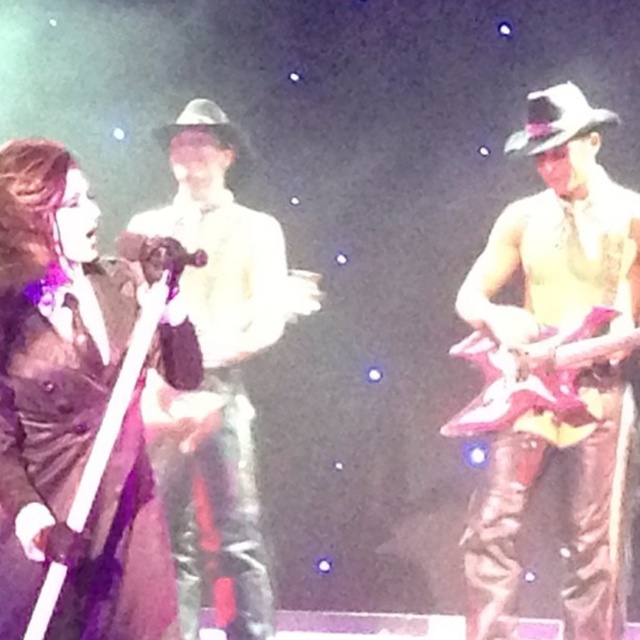
You are a photographer at the back of the stage. You want to take a photo of the matte black hat at center and the metallic pink guitar at right. Based on their positions, which object is closer to the left edge of your camera frame?

The matte black hat at center is positioned on the left side of the metallic pink guitar at right, so the matte black hat at center is closer to the left edge of the camera frame.

You are a stagehand who needs to place a new spotlight on the stage. The spotlight can only illuminate objects that are larger than 1 meter in size. Based on the scene, will the matte black hat at center and the shiny black guitar at left both be illuminated by the spotlight?

The matte black hat at center is bigger than the shiny black guitar at left. Since the spotlight requires objects larger than 1 meter, but the exact sizes aren